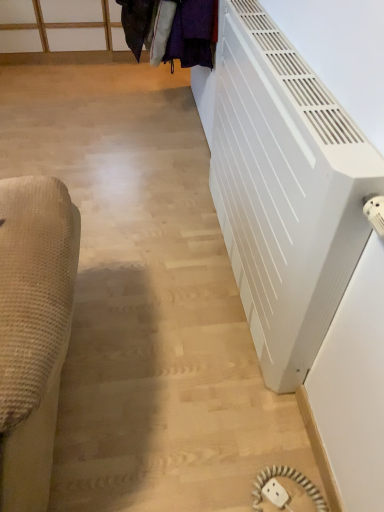
The width and height of the screenshot is (384, 512). Identify the location of free spot to the left of white plastic outlet at lower right. (225, 475).